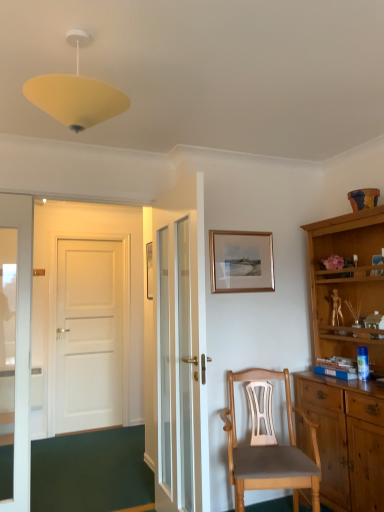
Question: Does point (109, 95) appear closer or farther from the camera than point (230, 399)?

Choices:
 (A) farther
 (B) closer

Answer: (B)

Question: Looking at the image, does yellow matte/soft plastic lampshade at upper center seem bigger or smaller compared to light brown wooden chair at center?

Choices:
 (A) small
 (B) big

Answer: (A)

Question: Which object is the farthest from the gold metallic picture frame at upper center?

Choices:
 (A) light brown wooden chair at center
 (B) white glass door at center
 (C) yellow matte/soft plastic lampshade at upper center

Answer: (C)

Question: Which of these objects is positioned farthest from the yellow matte/soft plastic lampshade at upper center?

Choices:
 (A) light brown wooden chair at center
 (B) white glass door at center
 (C) gold metallic picture frame at upper center

Answer: (A)